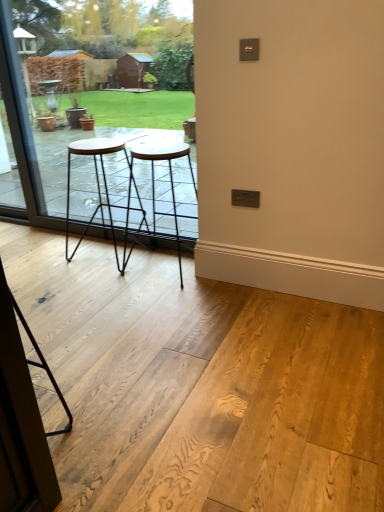
Identify the location of vacant point above black metal stool at center, the first stool when ordered from right to left (from a real-world perspective). (161, 146).